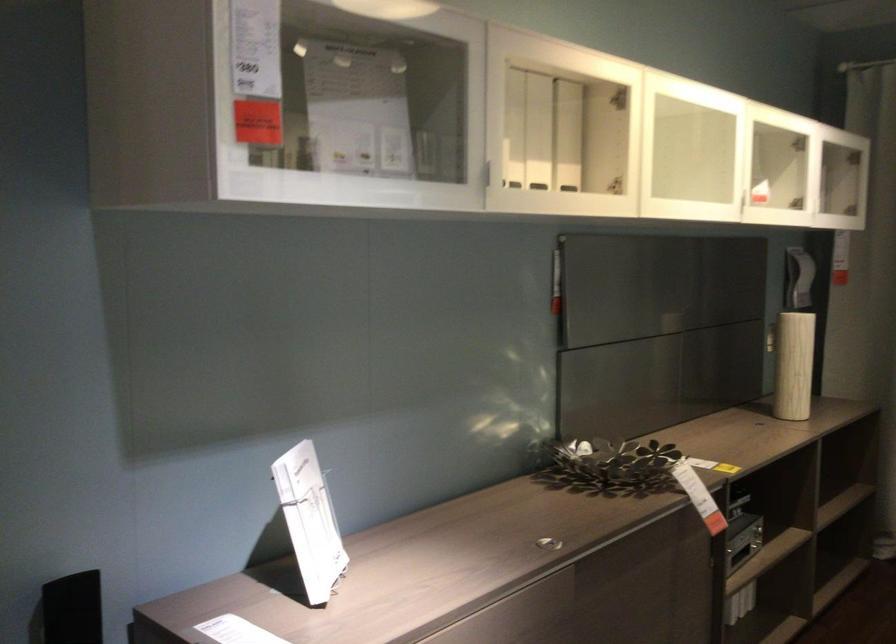
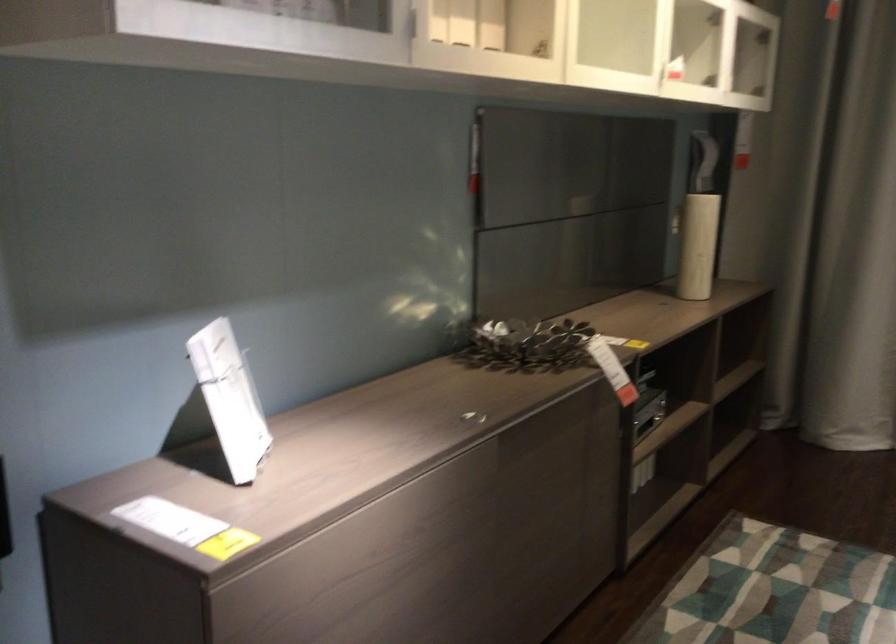
Which direction would the cameraman need to move to produce the second image?

The cameraman walked toward left, forward.